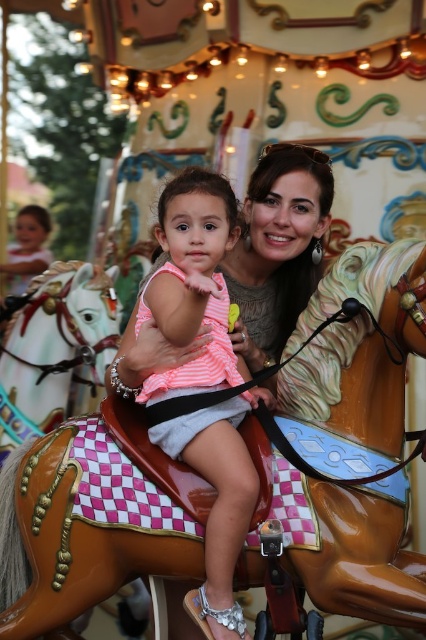
Looking at this image, can you confirm if pink striped fabric at center is thinner than polished white horse at center?

Correct, pink striped fabric at center's width is less than polished white horse at center's.

Is point (226, 502) positioned behind point (52, 355)?

No, it is in front of (52, 355).

Between point (207, 209) and point (60, 320), which one is positioned behind?

Positioned behind is point (60, 320).

You are a GUI agent. You are given a task and a screenshot of the screen. Output one action in this format:
    pyautogui.click(x=<x>, y=<y>)
    Task: Click on the pink striped fabric at center
    The width and height of the screenshot is (426, 640).
    Given the screenshot: What is the action you would take?
    pyautogui.click(x=192, y=282)

Which is in front, point (380, 531) or point (154, 394)?

Positioned in front is point (380, 531).

Identify the location of shiny brown horse at center. (94, 520).

Between point (342, 493) and point (51, 372), which one is positioned behind?

Positioned behind is point (51, 372).

Is shiny brown horse at center bigger than polished white horse at center?

Correct, shiny brown horse at center is larger in size than polished white horse at center.

Who is more distant from viewer, (x=313, y=376) or (x=60, y=387)?

The point (x=60, y=387) is behind.

In order to click on shiny brown horse at center in this screenshot , I will do `click(94, 520)`.